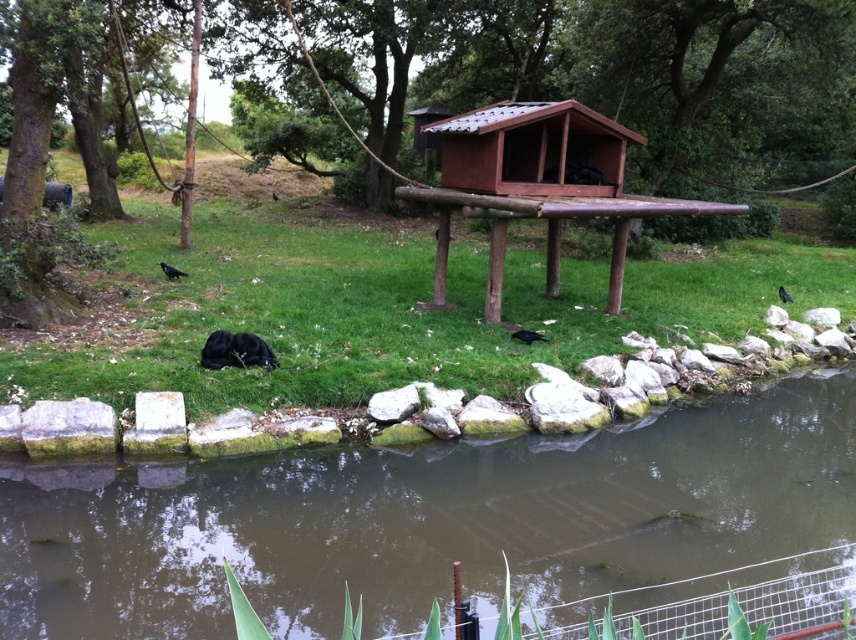
You are standing in the park and see the brown wooden hut at center and the black matte bird at lower center. Which object is positioned to the right of the other?

The brown wooden hut at center is to the right of the black matte bird at lower center.